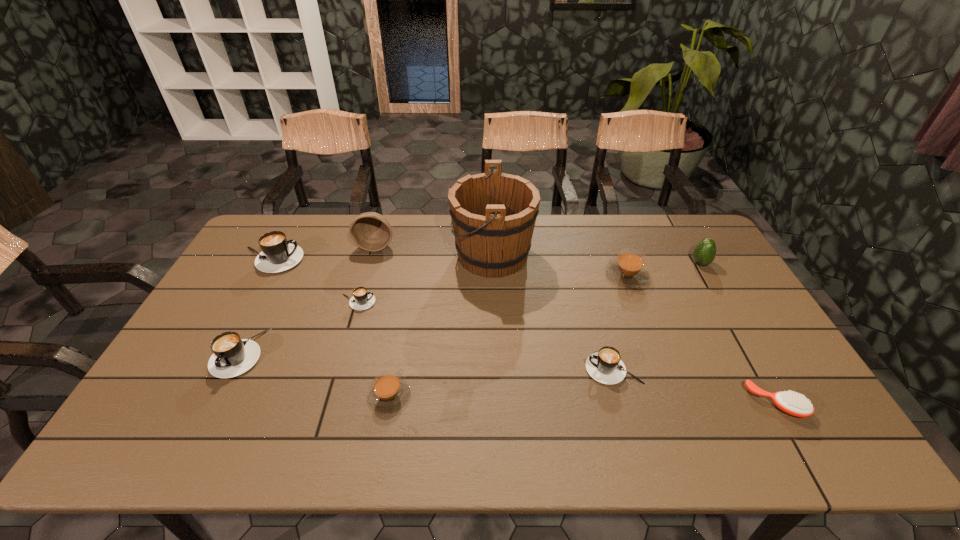
Identify the location of the left brown cappuccino. The image size is (960, 540). pos(389,393).

Find the location of `the fifth nearest object`. the fifth nearest object is located at coordinates (361, 300).

Where is `the smallest black cappuccino`? The width and height of the screenshot is (960, 540). the smallest black cappuccino is located at coordinates (361, 300).

Where is `hairbrush`? The height and width of the screenshot is (540, 960). hairbrush is located at coordinates (790, 402).

This screenshot has width=960, height=540. In order to click on free space located 0.380m on the side of the wine bucket with the handle for carrying in this screenshot , I will do `click(341, 255)`.

At what (x,y) coordinates should I click in order to perform the action: click on vacant space located on the side of the wine bucket with the handle for carrying. Please return your answer as a coordinate pair (x, y). The image size is (960, 540). Looking at the image, I should click on click(x=382, y=255).

The image size is (960, 540). In order to click on vacant space situated 0.240m on the side of the wine bucket with the handle for carrying in this screenshot , I will do `click(382, 255)`.

This screenshot has width=960, height=540. Find the location of `free spot located on the front of the ninth shortest object`. free spot located on the front of the ninth shortest object is located at coordinates (363, 292).

Find the location of a particular element. This screenshot has height=540, width=960. free space located 0.340m on the front of the avocado is located at coordinates (751, 351).

This screenshot has width=960, height=540. I want to click on free space located with the handle on the side of the farthest black cappuccino, so click(x=420, y=260).